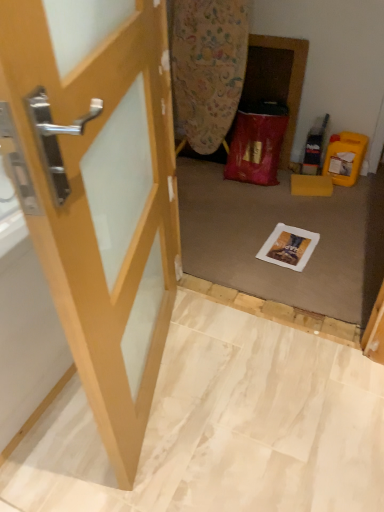
Locate an element on the screen. This screenshot has width=384, height=512. vacant area that is in front of light wood door at left is located at coordinates (161, 460).